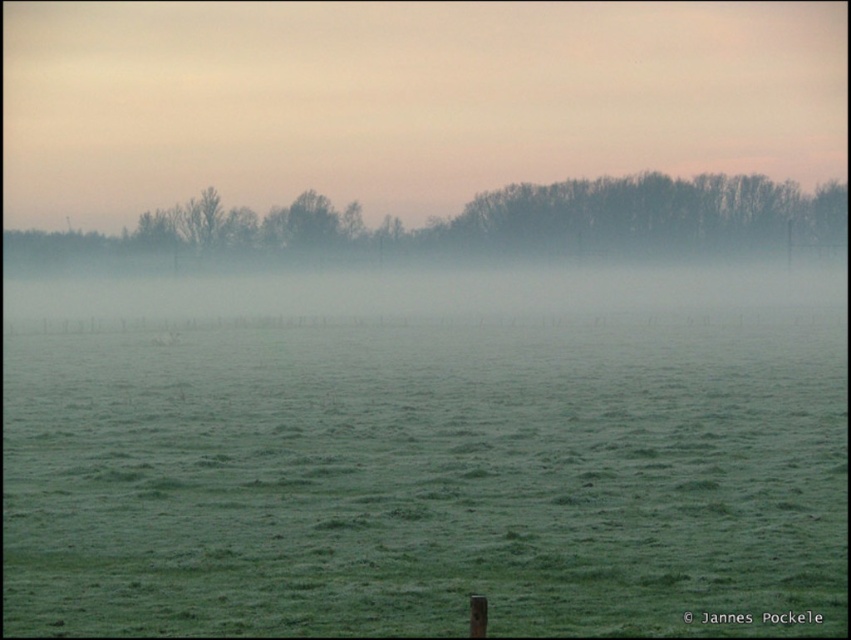
Which of these two, green grass at center or silhouette bare trees at upper center, stands shorter?

Standing shorter between the two is green grass at center.

Who is more forward, (300, 532) or (528, 200)?

Point (300, 532)

Identify the location of green grass at center. (423, 477).